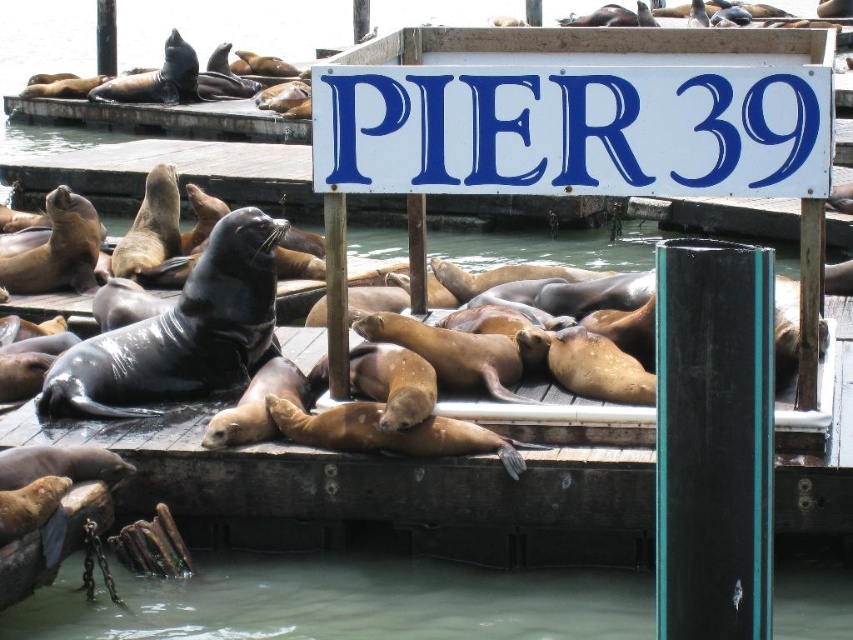
You are a visitor at Pier 39 and want to take a photo of the white painted wood sign at center and the greenish murky water at lower center. Which object is taller in the image?

The white painted wood sign at center is taller than the greenish murky water at lower center according to the description.

You are a photographer trying to capture both the white painted wood sign at center and the greenish murky water at lower center in a single frame. Based on their sizes, which object should you focus on first to ensure both are clearly visible in your photo?

The white painted wood sign at center has a larger size compared to greenish murky water at lower center, so you should focus on the white painted wood sign at center first to ensure both are clearly visible in your photo.

You are a photographer trying to capture the white painted wood sign at center and the greenish murky water at lower center in the same frame. Based on their positions, which object should you adjust your camera to focus on first if you want to include both in your shot?

The white painted wood sign at center is positioned on the right side of greenish murky water at lower center, so you should focus on the greenish murky water at lower center first to ensure both are in frame.